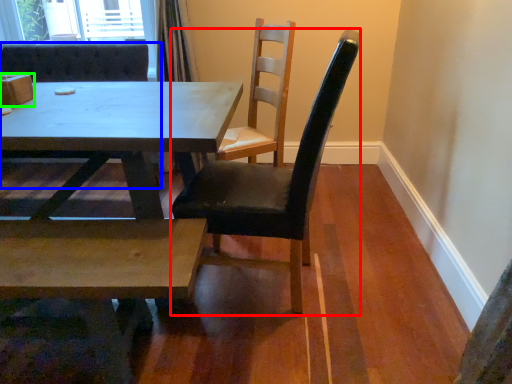
Question: Which object is positioned farthest from chair (highlighted by a red box)? Select from chair (highlighted by a blue box) and box (highlighted by a green box).

Choices:
 (A) chair
 (B) box

Answer: (A)